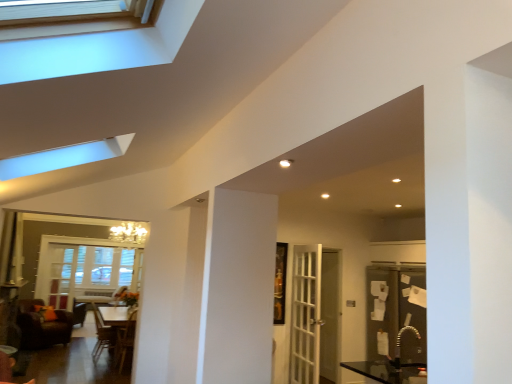
What do you see at coordinates (42, 326) in the screenshot? The width and height of the screenshot is (512, 384). I see `brown leather chair at lower left` at bounding box center [42, 326].

The image size is (512, 384). What do you see at coordinates (124, 343) in the screenshot?
I see `brown leather armchair at lower left, which is the first armchair from right to left` at bounding box center [124, 343].

Find the location of a particular element. Image resolution: width=512 pixels, height=384 pixels. brown leather armchair at lower left, which appears as the 2th armchair when viewed from the left is located at coordinates (124, 343).

Locate an element on the screen. This screenshot has height=384, width=512. white glass door at center is located at coordinates (306, 315).

Describe the element at coordinates (82, 269) in the screenshot. Image resolution: width=512 pixels, height=384 pixels. I see `white glass window at lower left, which ranks as the second window in front-to-back order` at that location.

What do you see at coordinates (102, 334) in the screenshot?
I see `dark brown leather armchair at center, marked as the 2th armchair in a right-to-left arrangement` at bounding box center [102, 334].

Describe the element at coordinates (330, 316) in the screenshot. I see `clear glass screen door at center` at that location.

Find the location of a particular element. The image size is (512, 384). brown leather chair at lower left is located at coordinates (42, 326).

Considering the relative sizes of brown leather chair at lower left and brown leather armchair at lower left, which appears as the 2th armchair when viewed from the left, in the image provided, is brown leather chair at lower left thinner than brown leather armchair at lower left, which appears as the 2th armchair when viewed from the left,?

Incorrect, the width of brown leather chair at lower left is not less than that of brown leather armchair at lower left, which appears as the 2th armchair when viewed from the left.

Considering the sizes of objects brown leather chair at lower left and brown leather armchair at lower left, which is the first armchair from right to left, in the image provided, who is shorter, brown leather chair at lower left or brown leather armchair at lower left, which is the first armchair from right to left,?

Standing shorter between the two is brown leather chair at lower left.

Looking at this image, from a real-world perspective, is brown leather chair at lower left physically located above or below brown leather armchair at lower left, which appears as the 2th armchair when viewed from the left?

brown leather chair at lower left is situated lower than brown leather armchair at lower left, which appears as the 2th armchair when viewed from the left, in the real world.

Is brown leather armchair at lower left, which is the first armchair from right to left, located within brown leather chair at lower left?

No.

Which armchair is the 1st one when counting from the left side of the gold metallic sink at lower right? Please provide its 2D coordinates.

[(124, 343)]

Which object is wider, brown leather armchair at lower left, which appears as the 2th armchair when viewed from the left, or gold metallic sink at lower right?

brown leather armchair at lower left, which appears as the 2th armchair when viewed from the left, is wider.

Is point (122, 351) behind point (398, 343)?

No.

From the image's perspective, is brown leather armchair at lower left, which appears as the 2th armchair when viewed from the left, beneath gold metallic sink at lower right?

Yes, from the image's perspective, brown leather armchair at lower left, which appears as the 2th armchair when viewed from the left, is beneath gold metallic sink at lower right.

Is white glass door at center taller than white glossy table at center?

Correct, white glass door at center is much taller as white glossy table at center.

Between white glass door at center and white glossy table at center, which one has smaller size?

With smaller size is white glass door at center.

Between point (298, 255) and point (122, 319), which one is positioned in front?

The point (298, 255) is closer.

Considering the relative positions of white glass door at center and white glossy table at center in the image provided, is white glass door at center to the right of white glossy table at center from the viewer's perspective?

Indeed, white glass door at center is positioned on the right side of white glossy table at center.

Is clear glass window at upper left, which is the second window from bottom to top, to the left of gold metallic sink at lower right from the viewer's perspective?

Yes.

Consider the image. Does clear glass window at upper left, marked as the 2th window in a back-to-front arrangement, have a greater height compared to gold metallic sink at lower right?

Correct, clear glass window at upper left, marked as the 2th window in a back-to-front arrangement, is much taller as gold metallic sink at lower right.

Is clear glass window at upper left, the second window from the left, wider or thinner than gold metallic sink at lower right?

clear glass window at upper left, the second window from the left, is wider than gold metallic sink at lower right.

Consider the image. Is clear glass screen door at center directly adjacent to clear glass window at upper left, marked as the 2th window in a back-to-front arrangement?

No, clear glass screen door at center is not beside clear glass window at upper left, marked as the 2th window in a back-to-front arrangement.

From the picture: From the image's perspective, between clear glass screen door at center and clear glass window at upper left, which is the second window from bottom to top, which one is located above?

From the image's view, clear glass window at upper left, which is the second window from bottom to top, is above.

Is dark brown leather armchair at center, marked as the 2th armchair in a right-to-left arrangement, bigger than white glossy table at center?

No, dark brown leather armchair at center, marked as the 2th armchair in a right-to-left arrangement, is not bigger than white glossy table at center.

Considering the positions of objects dark brown leather armchair at center, marked as the 2th armchair in a right-to-left arrangement, and white glossy table at center in the image provided, who is more to the left, dark brown leather armchair at center, marked as the 2th armchair in a right-to-left arrangement, or white glossy table at center?

Positioned to the left is dark brown leather armchair at center, marked as the 2th armchair in a right-to-left arrangement.

Can white glossy table at center be found inside dark brown leather armchair at center, the first armchair viewed from the left?

Definitely not — white glossy table at center is not inside dark brown leather armchair at center, the first armchair viewed from the left.

Which object is further away from the camera, dark brown leather armchair at center, the first armchair viewed from the left, or white glossy table at center?

dark brown leather armchair at center, the first armchair viewed from the left, is further from the camera.

Between point (50, 297) and point (404, 327), which one is positioned in front?

The point (404, 327) is closer.

I want to click on window located behind the gold metallic sink at lower right, so click(82, 269).

Does white glass window at lower left, the second window in the top-to-bottom sequence, lie behind gold metallic sink at lower right?

Yes, white glass window at lower left, the second window in the top-to-bottom sequence, is behind gold metallic sink at lower right.

I want to click on chair on the left of brown leather armchair at lower left, which is the first armchair from right to left, so click(x=42, y=326).

Find the location of a particular element. the 1st armchair behind when counting from the gold metallic sink at lower right is located at coordinates (124, 343).

Based on their spatial positions, is clear glass window at upper left, which is the second window from bottom to top, or white glossy table at center further from white glass window at lower left, the second window in the top-to-bottom sequence?

clear glass window at upper left, which is the second window from bottom to top, lies further to white glass window at lower left, the second window in the top-to-bottom sequence, than the other object.

In the scene shown: Looking at the image, which one is located further to brown leather chair at lower left, white glass door at center or white glossy table at center?

Among the two, white glass door at center is located further to brown leather chair at lower left.

From the image, which object appears to be farther from gold metallic sink at lower right, white glass door at center or brown leather chair at lower left?

brown leather chair at lower left.

From the image, which object appears to be nearer to clear glass window at upper left, the second window from the left, brown leather armchair at lower left, which is the first armchair from right to left, or clear glass screen door at center?

clear glass screen door at center is positioned closer to the anchor clear glass window at upper left, the second window from the left.

Looking at the image, which one is located further to clear glass screen door at center, gold metallic sink at lower right or white glass window at lower left, which ranks as the second window in front-to-back order?

white glass window at lower left, which ranks as the second window in front-to-back order, lies further to clear glass screen door at center than the other object.

When comparing their distances from dark brown leather armchair at center, marked as the 2th armchair in a right-to-left arrangement, does white glass door at center or brown leather chair at lower left seem closer?

brown leather chair at lower left is positioned closer to the anchor dark brown leather armchair at center, marked as the 2th armchair in a right-to-left arrangement.

Estimate the real-world distances between objects in this image. Which object is further from clear glass window at upper left, which is the second window from bottom to top, clear glass screen door at center or white glass door at center?

Based on the image, clear glass screen door at center appears to be further to clear glass window at upper left, which is the second window from bottom to top.

When comparing their distances from brown leather chair at lower left, does clear glass window at upper left, marked as the 2th window in a back-to-front arrangement, or white glass door at center seem closer?

Among the two, white glass door at center is located nearer to brown leather chair at lower left.

You are a GUI agent. You are given a task and a screenshot of the screen. Output one action in this format:
    pyautogui.click(x=<x>, y=<y>)
    Task: Click on the armchair between brown leather armchair at lower left, which is the first armchair from right to left, and white glass window at lower left, marked as the first window in a back-to-front arrangement, in the front-back direction
    The image size is (512, 384).
    Given the screenshot: What is the action you would take?
    point(102,334)

You are a GUI agent. You are given a task and a screenshot of the screen. Output one action in this format:
    pyautogui.click(x=<x>, y=<y>)
    Task: Click on the screen door between clear glass window at upper left, positioned as the 1th window in front-to-back order, and brown leather chair at lower left, along the z-axis
    
    Given the screenshot: What is the action you would take?
    pyautogui.click(x=330, y=316)

Identify the location of door between clear glass window at upper left, marked as the 1th window in a right-to-left arrangement, and brown leather chair at lower left, along the z-axis. (306, 315).

Identify the location of door positioned between gold metallic sink at lower right and clear glass screen door at center from near to far. The image size is (512, 384). (306, 315).